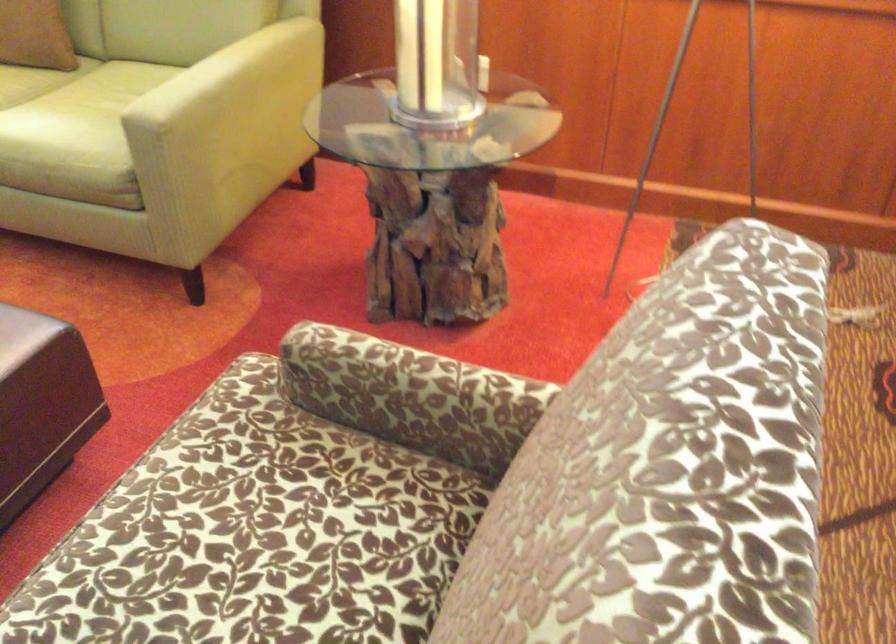
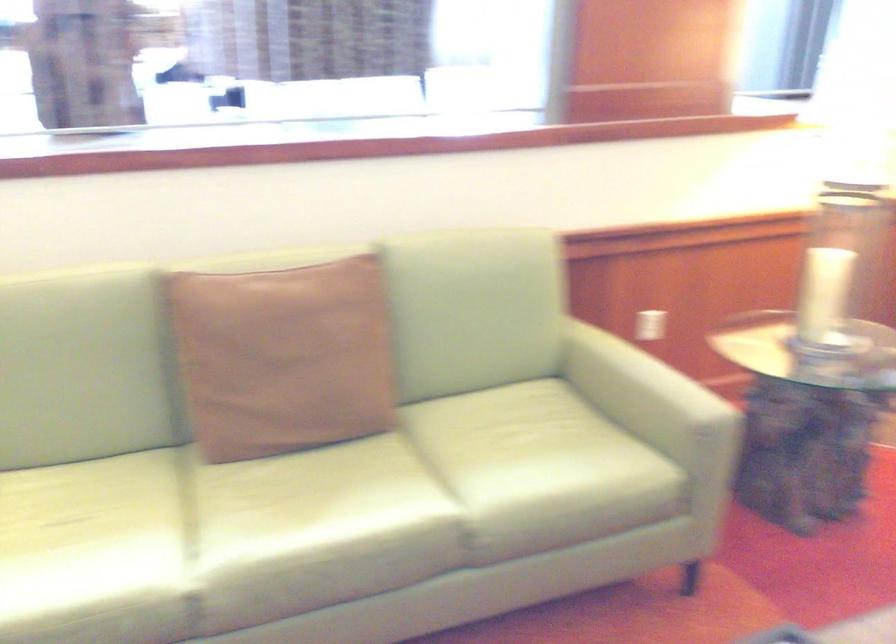
In the second image, find the point that corresponds to (x=167, y=77) in the first image.

(640, 386)